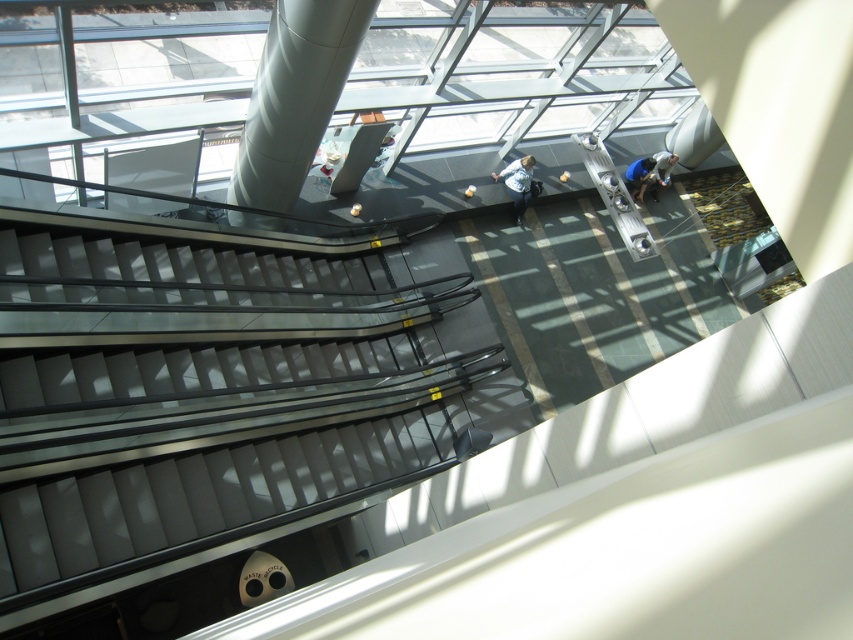
Question: Can you confirm if metallic gray escalator at lower left is positioned to the right of satin silver column at center?

Choices:
 (A) no
 (B) yes

Answer: (B)

Question: Which point is closer to the camera?

Choices:
 (A) (514, 202)
 (B) (310, 45)

Answer: (B)

Question: Does metallic gray escalator at lower left lie behind light blue denim jacket at center?

Choices:
 (A) no
 (B) yes

Answer: (A)

Question: Estimate the real-world distances between objects in this image. Which object is closer to the satin silver column at center?

Choices:
 (A) metallic gray escalator at lower left
 (B) light blue denim jacket at center

Answer: (A)

Question: Which object is positioned closest to the light blue denim jacket at center?

Choices:
 (A) blue fabric shirt at upper right
 (B) satin silver column at center
 (C) metallic gray escalator at lower left

Answer: (A)

Question: Can you confirm if satin silver column at center is wider than blue fabric shirt at upper right?

Choices:
 (A) no
 (B) yes

Answer: (B)